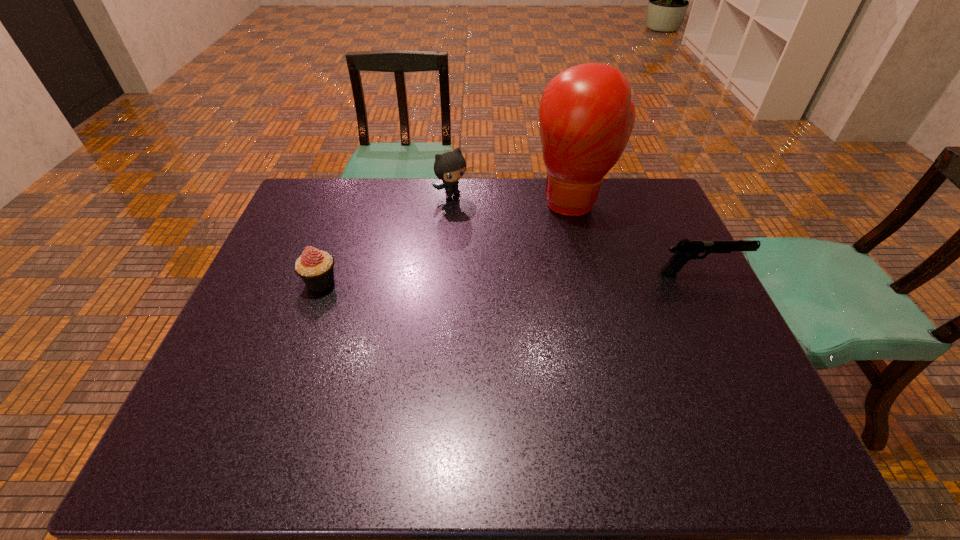
Locate an element on the screen. free space on the desktop that is between the leftmost object and the gun and is positioned on the front-facing side of the second object from left to right is located at coordinates (539, 277).

Locate an element on the screen. free space on the desktop that is between the cupcake and the gun and is positioned on the striking surface of the tallest object is located at coordinates (568, 276).